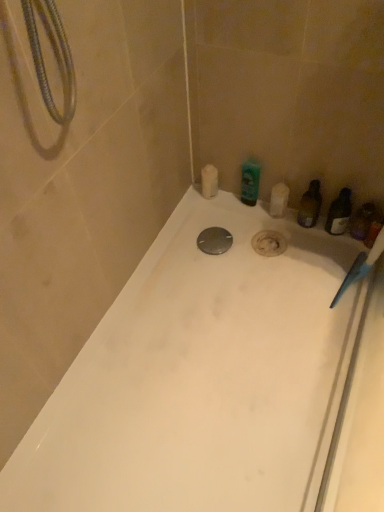
Question: Is white matte soap bar at upper center, the fourth toiletry positioned from the right, in front of or behind green glossy bottle at upper right, the second toiletry viewed from the left, in the image?

Choices:
 (A) front
 (B) behind

Answer: (B)

Question: Is white matte soap bar at upper center, which appears as the first toiletry when viewed from the left, situated inside green glossy bottle at upper right, the second toiletry viewed from the left, or outside?

Choices:
 (A) outside
 (B) inside

Answer: (A)

Question: Which is nearer to the white matte soap bar at upper center, the fourth toiletry positioned from the right?

Choices:
 (A) green glossy bottle at upper right, acting as the 3th toiletry starting from the right
 (B) metallic silver drain at center
 (C) translucent plastic bottle at right, positioned as the 4th toiletry in left-to-right order
 (D) translucent plastic bottle at right, marked as the second toiletry in a right-to-left arrangement
 (E) white glossy bathtub at center

Answer: (A)

Question: Estimate the real-world distances between objects in this image. Which object is closer to the white matte soap bar at upper center, the fourth toiletry positioned from the right?

Choices:
 (A) green glossy bottle at upper right, the second toiletry viewed from the left
 (B) white glossy bathtub at center
 (C) translucent plastic bottle at right, placed as the 1th toiletry when sorted from right to left
 (D) metallic silver drain at center
 (E) translucent plastic bottle at right, marked as the second toiletry in a right-to-left arrangement

Answer: (A)